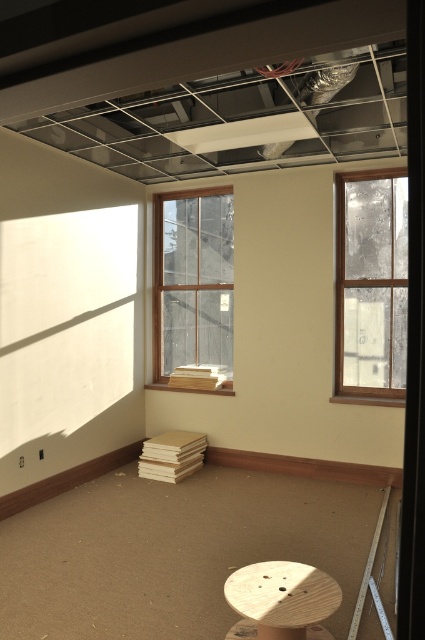
Question: Which object is closer to the camera taking this photo?

Choices:
 (A) clear glass window at right
 (B) clear glass window at center

Answer: (A)

Question: Does clear glass window at center appear on the right side of wooden stool at lower center?

Choices:
 (A) yes
 (B) no

Answer: (B)

Question: Which of the following is the closest to the observer?

Choices:
 (A) pyautogui.click(x=283, y=624)
 (B) pyautogui.click(x=195, y=336)

Answer: (A)

Question: Is the position of clear glass window at right less distant than that of clear glass window at center?

Choices:
 (A) yes
 (B) no

Answer: (A)

Question: Does clear glass window at right have a lesser width compared to wooden stool at lower center?

Choices:
 (A) no
 (B) yes

Answer: (A)

Question: Which is farther from the wooden stool at lower center?

Choices:
 (A) clear glass window at right
 (B) clear glass window at center

Answer: (B)